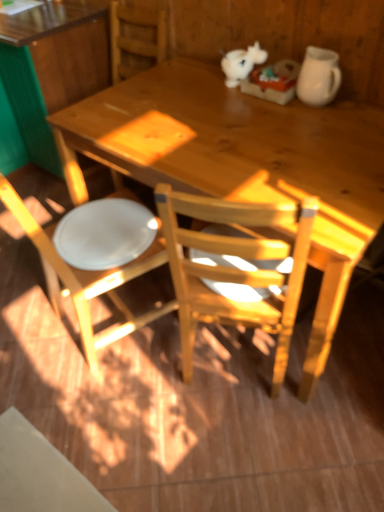
Locate an element on the screen. The image size is (384, 512). free spot in front of wooden desk at center, which is the second desk from left to right is located at coordinates (203, 434).